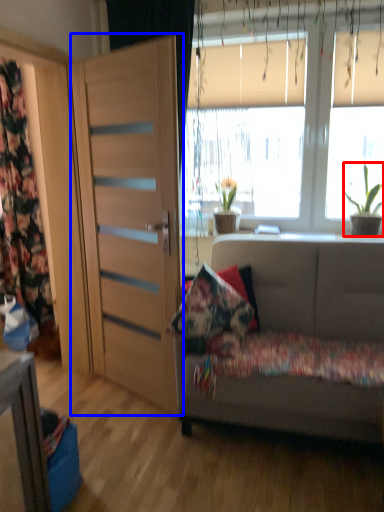
Question: Which of the following is the farthest to the observer, houseplant (highlighted by a red box) or door (highlighted by a blue box)?

Choices:
 (A) houseplant
 (B) door

Answer: (A)